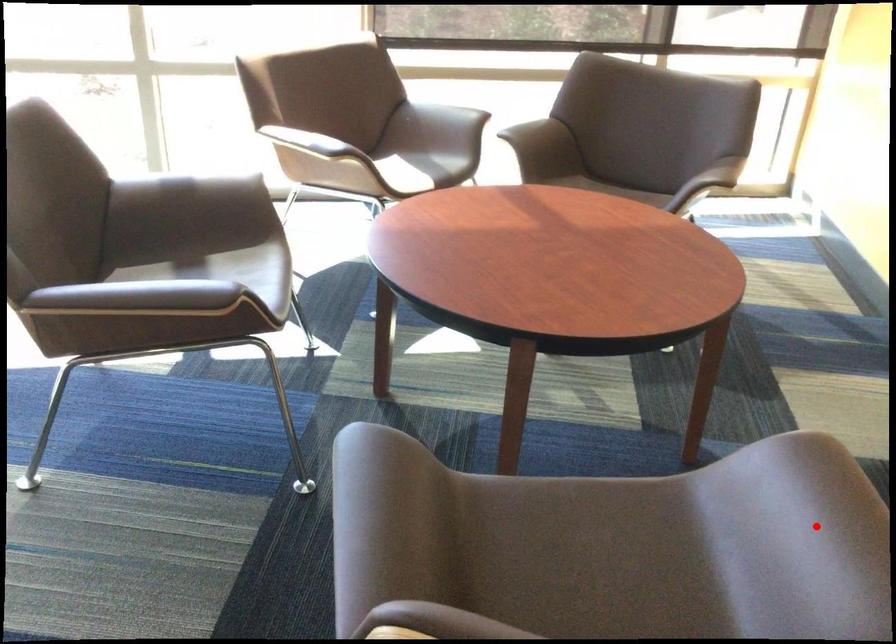
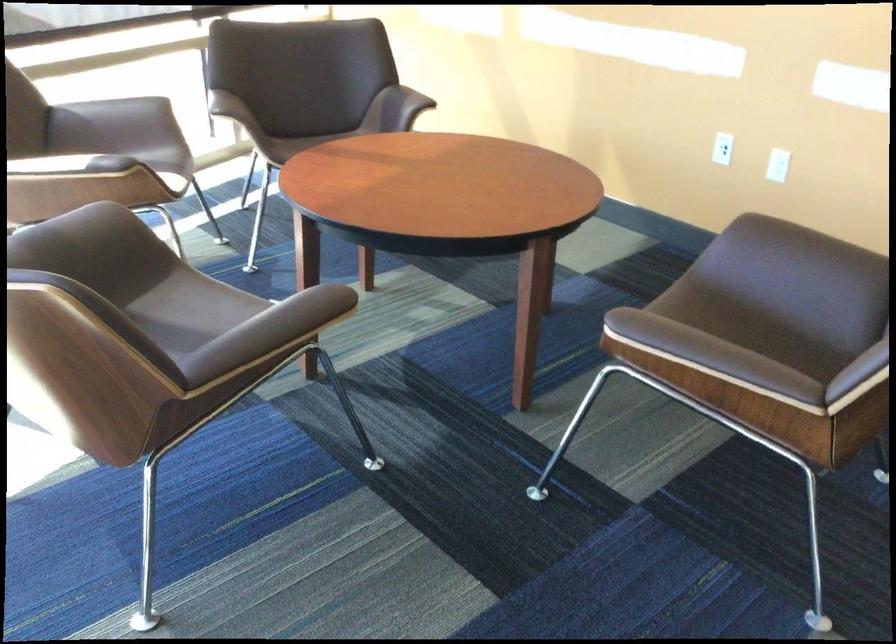
The point at the highlighted location is marked in the first image. Where is the corresponding point in the second image?

(802, 251)